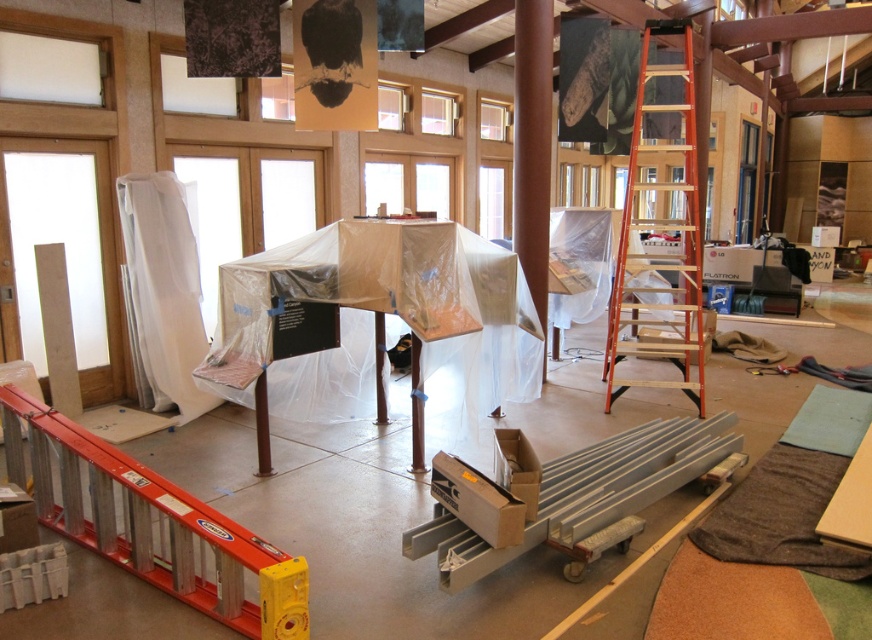
Based on the photo, you are a contractor assessing the renovation site. You need to choose between the aluminum ladder at lower left and the orange aluminum ladder at right for reaching a high ceiling beam. Which ladder should you choose and why?

You should choose the aluminum ladder at lower left because it is larger in size than the orange aluminum ladder at right, making it more suitable for reaching high ceiling beams.

You are a construction worker needing to reach a high point on the wall. You see an aluminum ladder at lower left and an orange aluminum ladder at right. Which ladder is positioned lower in the image?

The aluminum ladder at lower left is located below the orange aluminum ladder at right, so it is positioned lower in the image.

You are a construction worker who needs to reach a high shelf that is 2.5 meters tall. You have two ladders available in the scene. Which ladder should you choose between the aluminum ladder at lower left and the orange aluminum ladder at right?

The aluminum ladder at lower left is taller than the orange aluminum ladder at right, so you should choose the aluminum ladder at lower left to reach the high shelf that is 2.5 meters tall.